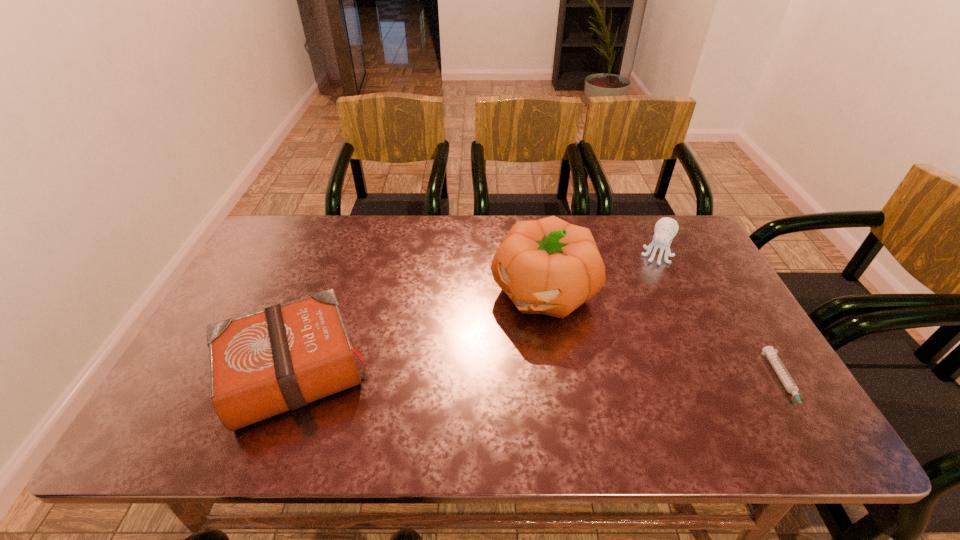
Find the location of a particular element. The height and width of the screenshot is (540, 960). Bible is located at coordinates (262, 364).

Locate an element on the screen. the shortest object is located at coordinates (789, 384).

At what (x,y) coordinates should I click in order to perform the action: click on syringe. Please return your answer as a coordinate pair (x, y). The image size is (960, 540). Looking at the image, I should click on (789, 384).

This screenshot has height=540, width=960. I want to click on octopus, so click(x=666, y=228).

The image size is (960, 540). I want to click on the second object from left to right, so click(548, 266).

Locate an element on the screen. This screenshot has height=540, width=960. pumpkin is located at coordinates (548, 266).

Find the location of `vacant position located 0.180m on the back of the Bible`. vacant position located 0.180m on the back of the Bible is located at coordinates (329, 275).

Identify the location of free space located on the front-facing side of the third object from left to right. The image size is (960, 540). (636, 308).

Locate an element on the screen. The height and width of the screenshot is (540, 960). vacant space located 0.130m on the front-facing side of the third object from left to right is located at coordinates (643, 291).

Where is `vacant point located on the front-facing side of the third object from left to right`? The width and height of the screenshot is (960, 540). vacant point located on the front-facing side of the third object from left to right is located at coordinates (620, 349).